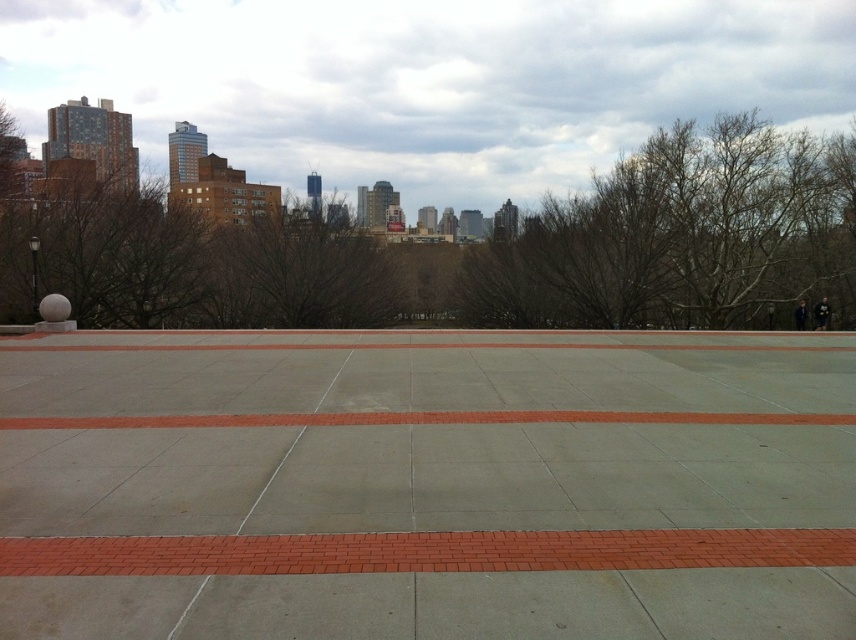
You are standing in the plaza and want to walk to the tall building with a blue facade. Which direction should you walk to avoid stepping on the concrete at center?

To avoid stepping on the concrete at center, you should walk towards the tall building with a blue facade in the direction opposite to the concrete at center. Since the concrete at center is located at point coordinates, you can navigate around it by moving either to the left or right side of the plaza, ensuring you stay clear of the specified area.

You are a city planner analyzing the plaza layout. You need to place a bench between the brown leafless tree at left and the brown leafless tree at center. Which tree should the bench be closer to if you want it to be near the wider tree?

The bench should be placed closer to the brown leafless tree at center because it has a greater width than the brown leafless tree at left.

You are standing in the plaza and want to take a photo of both the brown leafless tree at left and the brown leafless tree at center. Which direction should you face to ensure both are in your camera frame?

You should face towards the right side of the plaza so that both the brown leafless tree at left and the brown leafless tree at center are visible in your camera frame. Since the brown leafless tree at left is to the left of the brown leafless tree at center, positioning yourself to the right allows both trees to be captured in the frame.